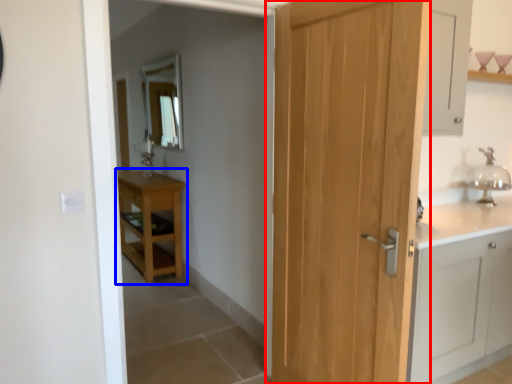
Question: Which of the following is the closest to the observer, door (highlighted by a red box) or table (highlighted by a blue box)?

Choices:
 (A) door
 (B) table

Answer: (A)